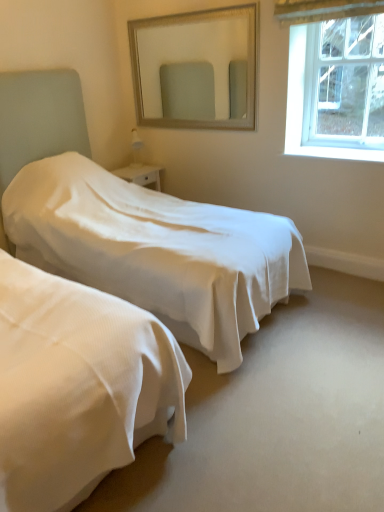
Question: From the image's perspective, is silver textured mirror at upper center beneath clear glass window at upper right?

Choices:
 (A) yes
 (B) no

Answer: (B)

Question: From a real-world perspective, is silver textured mirror at upper center under clear glass window at upper right?

Choices:
 (A) no
 (B) yes

Answer: (A)

Question: From the image's perspective, is silver textured mirror at upper center on clear glass window at upper right?

Choices:
 (A) yes
 (B) no

Answer: (A)

Question: Does silver textured mirror at upper center lie in front of clear glass window at upper right?

Choices:
 (A) yes
 (B) no

Answer: (B)

Question: Considering the relative sizes of silver textured mirror at upper center and clear glass window at upper right in the image provided, is silver textured mirror at upper center smaller than clear glass window at upper right?

Choices:
 (A) no
 (B) yes

Answer: (A)

Question: Does point (173, 27) appear closer or farther from the camera than point (251, 214)?

Choices:
 (A) closer
 (B) farther

Answer: (B)

Question: Considering the positions of silver textured mirror at upper center and white smooth bed at center in the image, is silver textured mirror at upper center wider or thinner than white smooth bed at center?

Choices:
 (A) thin
 (B) wide

Answer: (A)

Question: Is silver textured mirror at upper center inside or outside of white smooth bed at center?

Choices:
 (A) outside
 (B) inside

Answer: (A)

Question: Considering the positions of silver textured mirror at upper center and white smooth bed at center in the image, is silver textured mirror at upper center bigger or smaller than white smooth bed at center?

Choices:
 (A) small
 (B) big

Answer: (A)

Question: Is white smooth bed at center spatially inside silver textured mirror at upper center, or outside of it?

Choices:
 (A) inside
 (B) outside

Answer: (B)

Question: Considering the positions of white smooth bed at center and silver textured mirror at upper center in the image, is white smooth bed at center bigger or smaller than silver textured mirror at upper center?

Choices:
 (A) small
 (B) big

Answer: (B)

Question: From the image's perspective, is white smooth bed at center positioned above or below silver textured mirror at upper center?

Choices:
 (A) above
 (B) below

Answer: (B)

Question: Relative to silver textured mirror at upper center, is white smooth bed at center in front or behind?

Choices:
 (A) behind
 (B) front

Answer: (B)

Question: From the image's perspective, is white smooth bed at center located above or below clear glass window at upper right?

Choices:
 (A) below
 (B) above

Answer: (A)

Question: Considering the positions of point (175, 212) and point (314, 13), is point (175, 212) closer or farther from the camera than point (314, 13)?

Choices:
 (A) closer
 (B) farther

Answer: (B)